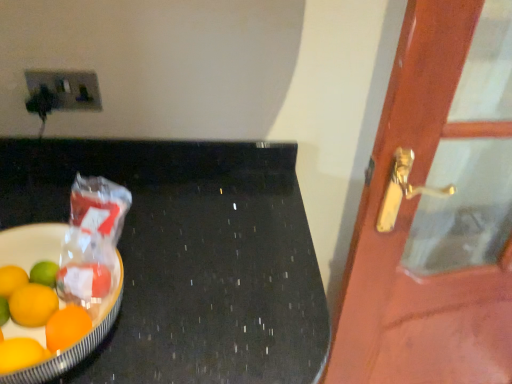
Identify the location of free point behind shiny plastic bowl at left. (130, 206).